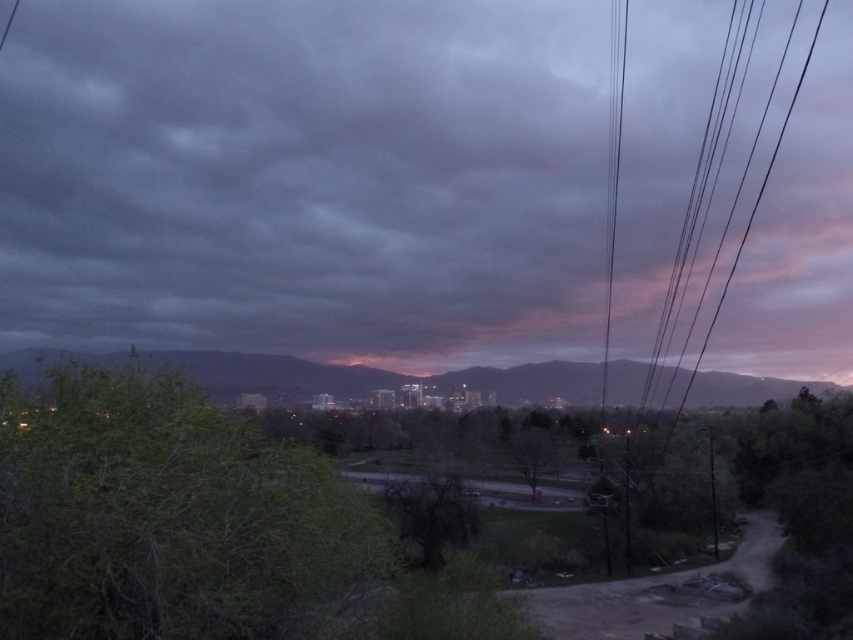
Question: Among these objects, which one is nearest to the camera?

Choices:
 (A) black wire at right
 (B) bare branches at center
 (C) rocky mountain at center
 (D) green leafy tree at lower left

Answer: (D)

Question: Which point is farther to the camera?

Choices:
 (A) (529, 468)
 (B) (605, 307)
 (C) (219, 380)

Answer: (B)

Question: Is green leafy tree at lower left positioned before black wire at right?

Choices:
 (A) yes
 (B) no

Answer: (A)

Question: In this image, where is green leafy tree at lower left located relative to rocky mountain at center?

Choices:
 (A) below
 (B) above

Answer: (B)

Question: Considering the relative positions of green leafy tree at lower left and black wire at right in the image provided, where is green leafy tree at lower left located with respect to black wire at right?

Choices:
 (A) right
 (B) left

Answer: (B)

Question: Which object appears closest to the camera in this image?

Choices:
 (A) green leafy tree at lower left
 (B) rocky mountain at center

Answer: (A)